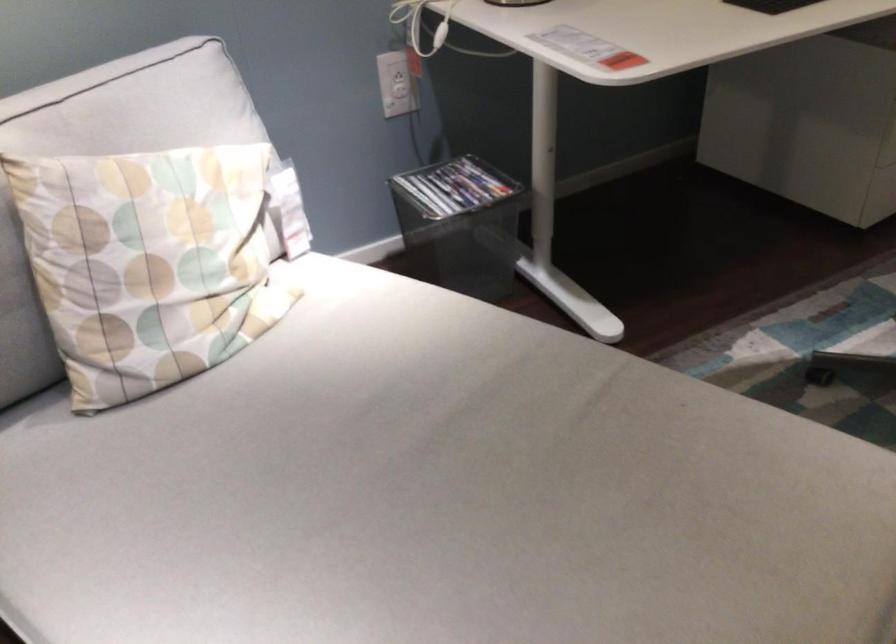
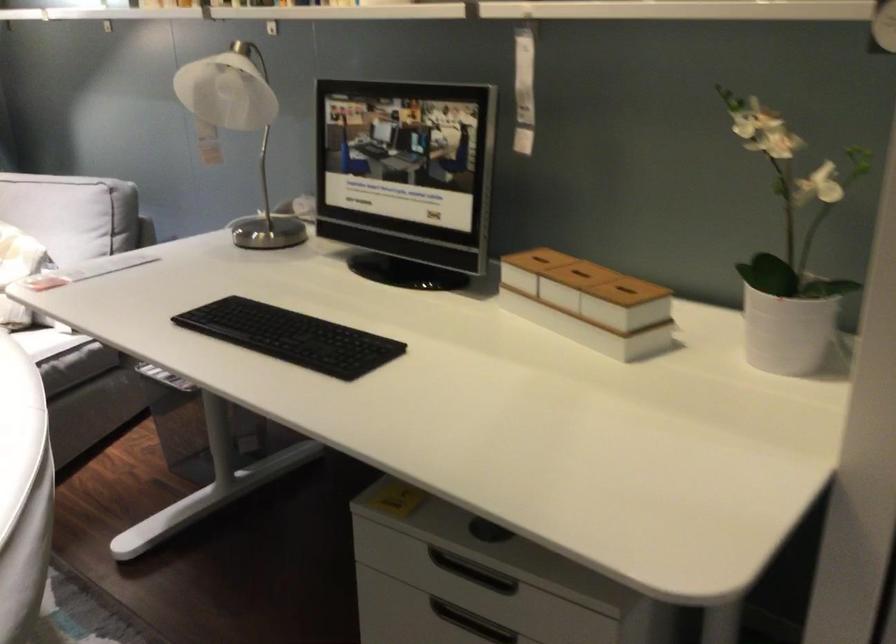
Question: I am providing you with two images of the same scene from different viewpoints. Which of the following objects are not visible in image2?

Choices:
 (A) cabinet drawer handle
 (B) magazine in bin
 (C) white bottle trigger
 (D) organizer box lid

Answer: (B)